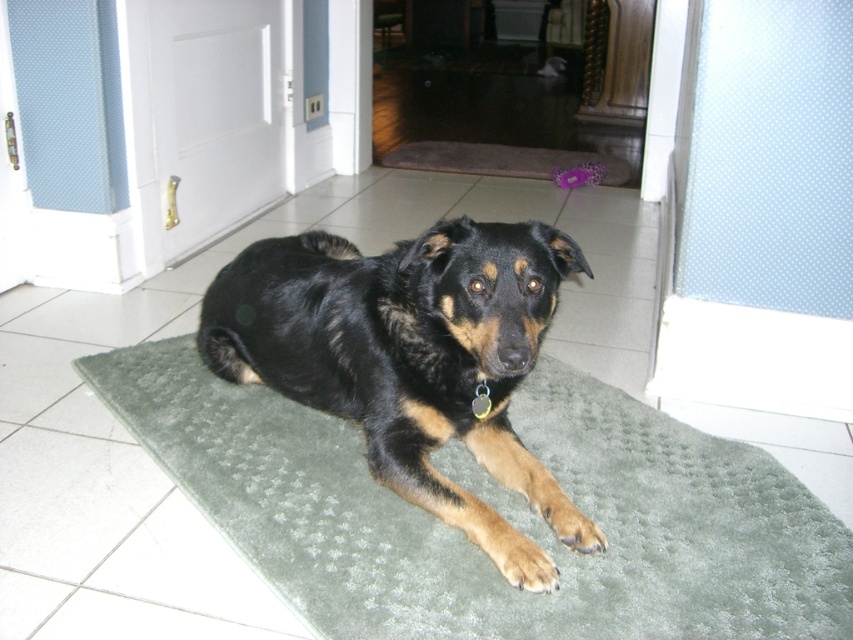
Who is positioned more to the right, green textured mat at center or black fur dog at center?

green textured mat at center is more to the right.

Between green textured mat at center and black fur dog at center, which one has less height?

Standing shorter between the two is green textured mat at center.

Does point (509, 625) come in front of point (515, 332)?

Yes, it is.

The height and width of the screenshot is (640, 853). Identify the location of green textured mat at center. (496, 509).

Between black fur dog at center and brown textured mat at center, which one has less height?

brown textured mat at center is shorter.

Which of these two, black fur dog at center or brown textured mat at center, stands taller?

black fur dog at center

Measure the distance between point (x=277, y=378) and camera.

Point (x=277, y=378) is 1.79 meters away from camera.

This screenshot has width=853, height=640. I want to click on black fur dog at center, so click(410, 358).

Can you confirm if green textured mat at center is taller than brown textured mat at center?

Indeed, green textured mat at center has a greater height compared to brown textured mat at center.

Based on the photo, does green textured mat at center appear under brown textured mat at center?

Correct, green textured mat at center is located below brown textured mat at center.

Is point (810, 497) farther from viewer compared to point (389, 161)?

No.

Locate an element on the screen. The height and width of the screenshot is (640, 853). green textured mat at center is located at coordinates (496, 509).